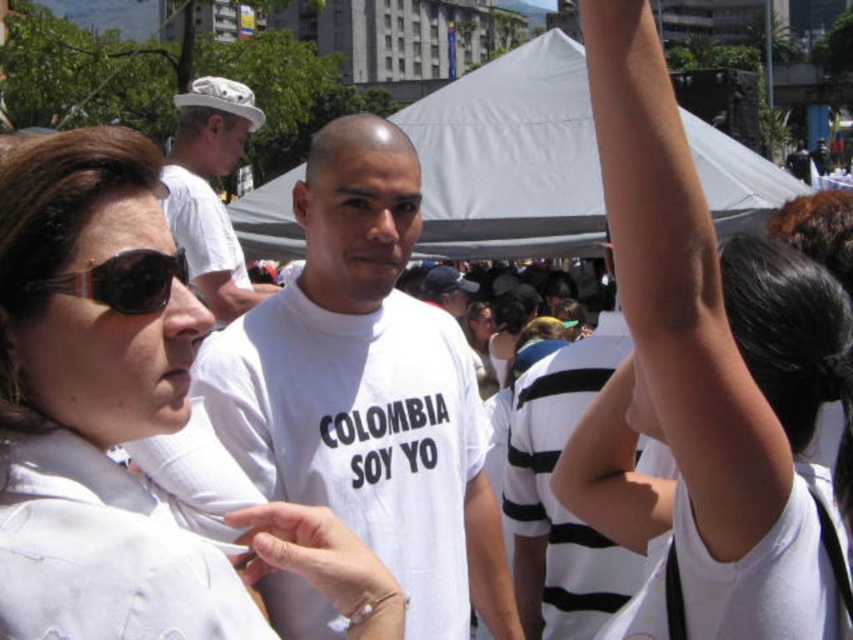
Does white matte shirt at center lie in front of white cotton t-shirt at center?

That is True.

Does white matte shirt at center appear on the right side of white cotton t-shirt at center?

Incorrect, white matte shirt at center is not on the right side of white cotton t-shirt at center.

Between point (96, 532) and point (393, 220), which one is positioned in front?

Point (96, 532)

At what (x,y) coordinates should I click in order to perform the action: click on white matte shirt at center. Please return your answer as a coordinate pair (x, y). Image resolution: width=853 pixels, height=640 pixels. Looking at the image, I should click on (96, 396).

How much distance is there between white cotton t-shirt at center and black plastic sunglasses at upper left?

The distance of white cotton t-shirt at center from black plastic sunglasses at upper left is 14.65 meters.

Can you confirm if white cotton t-shirt at center is shorter than black plastic sunglasses at upper left?

In fact, white cotton t-shirt at center may be taller than black plastic sunglasses at upper left.

I want to click on white cotton t-shirt at center, so click(x=367, y=388).

In the scene shown: Does white cotton t-shirt at center appear on the right side of white fabric canopy at center?

Incorrect, white cotton t-shirt at center is not on the right side of white fabric canopy at center.

Describe the element at coordinates (367, 388) in the screenshot. Image resolution: width=853 pixels, height=640 pixels. I see `white cotton t-shirt at center` at that location.

Between point (302, 445) and point (584, 100), which one is positioned in front?

Positioned in front is point (302, 445).

What are the coordinates of `white cotton t-shirt at center` in the screenshot? It's located at (367, 388).